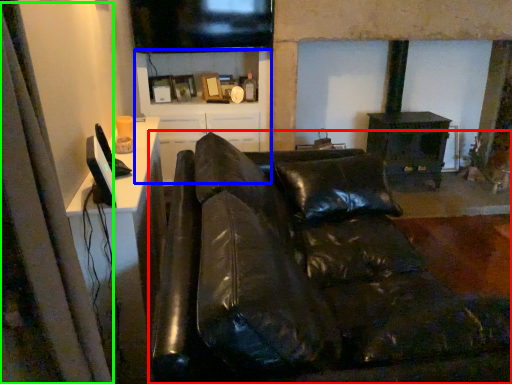
Question: Estimate the real-world distances between objects in this image. Which object is closer to studio couch (highlighted by a red box), tv cabinet (highlighted by a blue box) or curtain (highlighted by a green box)?

Choices:
 (A) tv cabinet
 (B) curtain

Answer: (B)